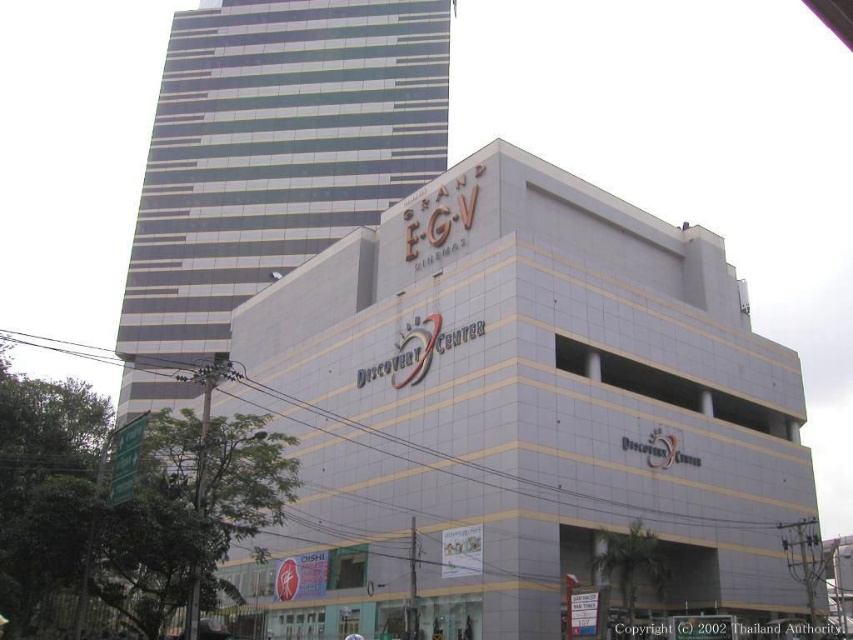
Is white smooth building at center behind metallic glass building at upper left?

That is False.

Is point (300, 608) positioned before point (438, 48)?

Yes.

The height and width of the screenshot is (640, 853). What are the coordinates of `white smooth building at center` in the screenshot? It's located at click(x=517, y=416).